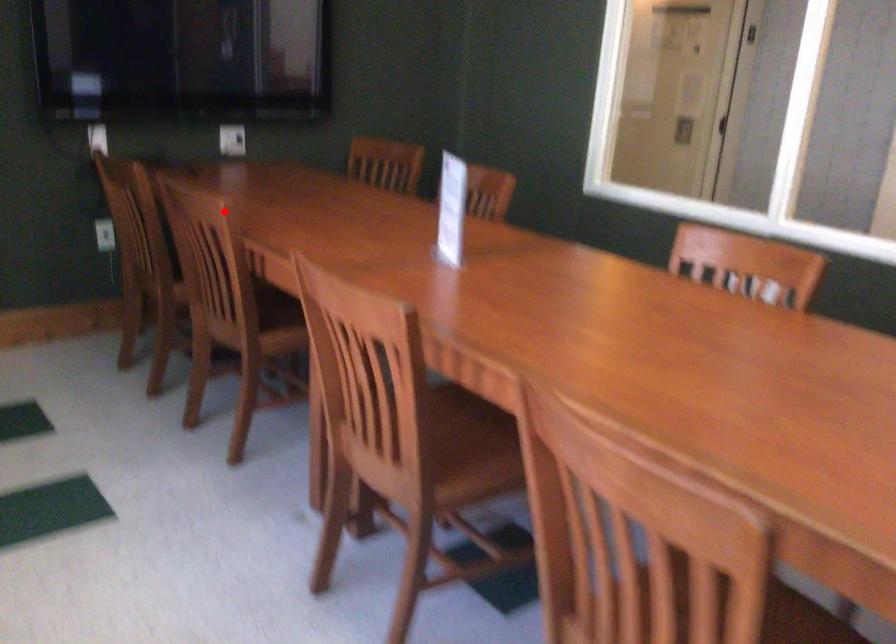
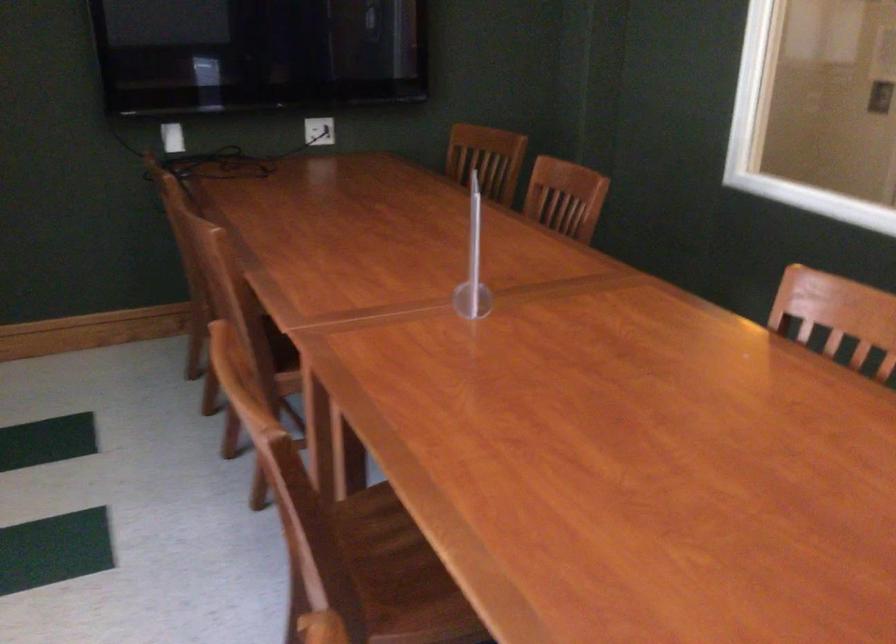
Where in the second image is the point corresponding to the highlighted location from the first image?

(216, 242)